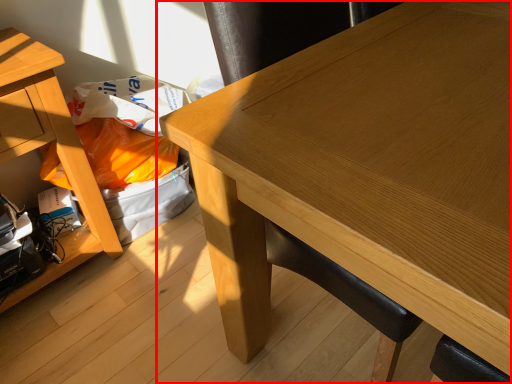
Question: From the image, what is the correct spatial relationship of table (annotated by the red box) in relation to table?

Choices:
 (A) right
 (B) left

Answer: (A)